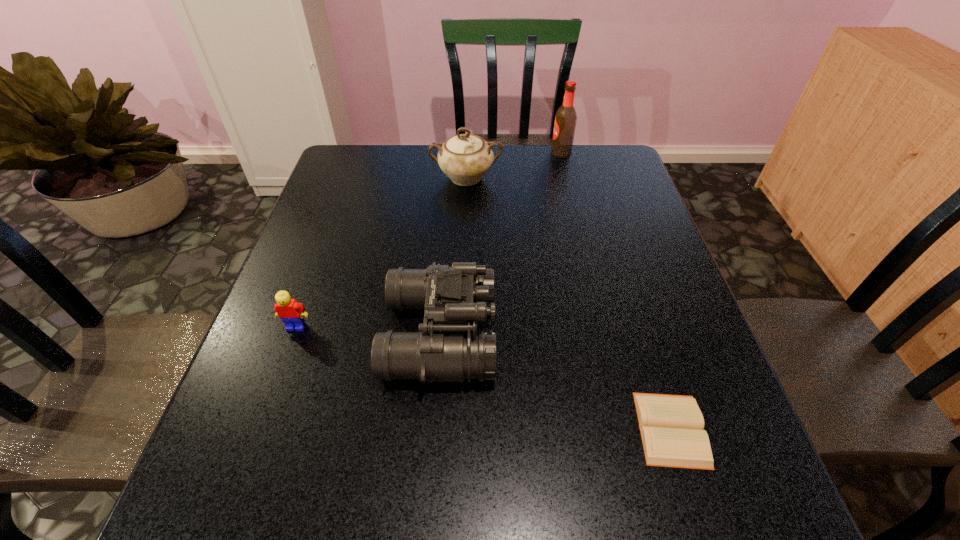
Locate an element on the screen. vacant space at the far left corner of the desktop is located at coordinates (340, 147).

Find the location of a particular element. free space at the far right corner of the desktop is located at coordinates (619, 144).

Identify the location of blank space at the near right corner. The height and width of the screenshot is (540, 960). (727, 517).

The width and height of the screenshot is (960, 540). In order to click on unoccupied position between the beer bottle and the binoculars in this screenshot , I will do `click(500, 244)`.

Locate an element on the screen. This screenshot has height=540, width=960. free spot between the binoculars and the beer bottle is located at coordinates (500, 244).

Where is `empty location between the beer bottle and the fourth tallest object`? This screenshot has width=960, height=540. empty location between the beer bottle and the fourth tallest object is located at coordinates (429, 240).

Locate an element on the screen. Image resolution: width=960 pixels, height=540 pixels. free point between the tallest object and the second farthest object is located at coordinates coord(514,165).

Find the location of a particular element. This screenshot has width=960, height=540. vacant area that lies between the second shortest object and the beer bottle is located at coordinates (429, 240).

Identify the location of vacant space in between the tallest object and the leftmost object. (429, 240).

You are a GUI agent. You are given a task and a screenshot of the screen. Output one action in this format:
    pyautogui.click(x=<x>, y=<y>)
    Task: Click on the empty space that is in between the chinaware and the binoculars
    
    Given the screenshot: What is the action you would take?
    pyautogui.click(x=453, y=256)